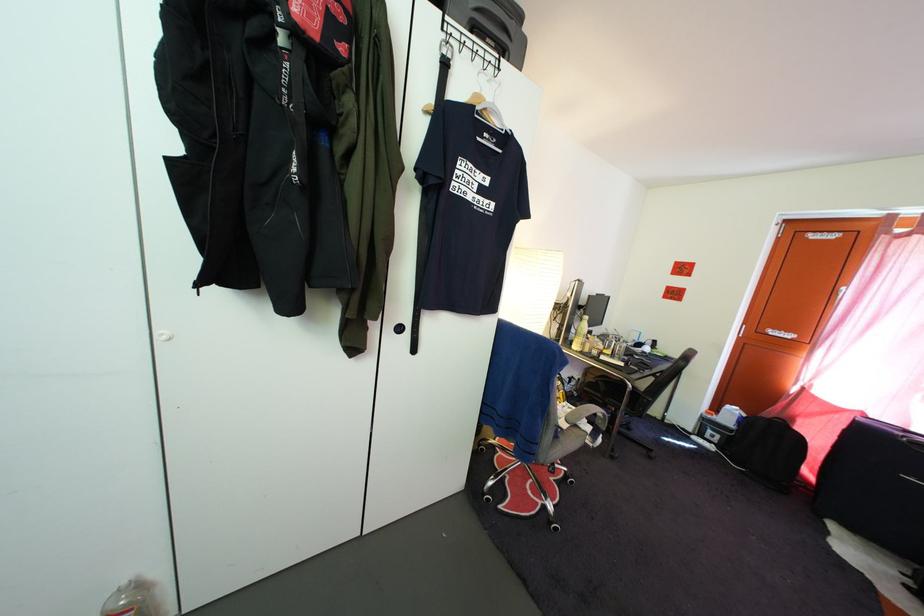
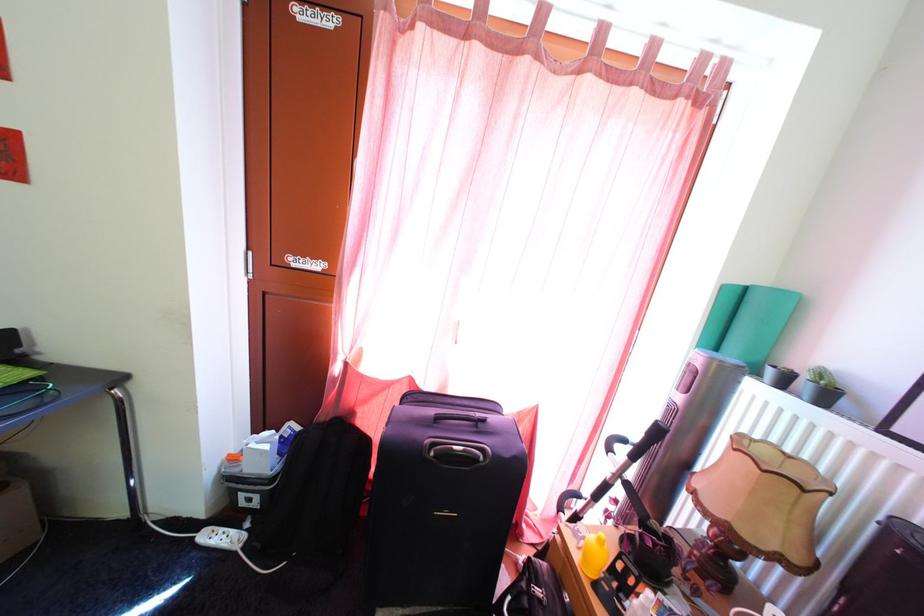
The point at (699, 442) is marked in the first image. Where is the corresponding point in the second image?

(208, 533)